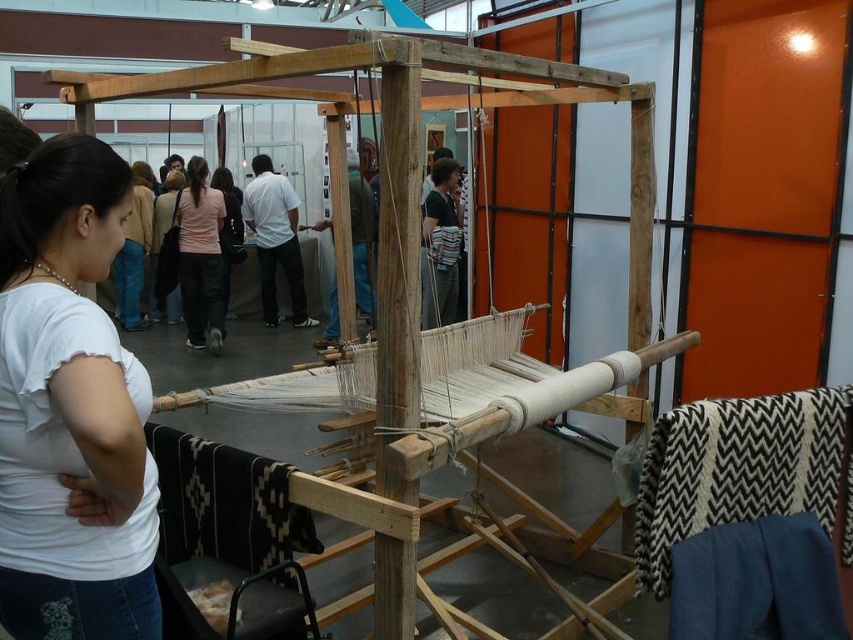
Question: Estimate the real-world distances between objects in this image. Which object is closer to the white cotton shirt at left?

Choices:
 (A) black and white zigzag fabric at lower right
 (B) pink fabric at center

Answer: (A)

Question: Does black and white zigzag fabric at lower right have a smaller size compared to pink fabric at center?

Choices:
 (A) yes
 (B) no

Answer: (A)

Question: Which object is farther from the camera taking this photo?

Choices:
 (A) black and white zigzag fabric at lower right
 (B) white cotton shirt at left
 (C) pink fabric at center

Answer: (C)

Question: Which point is closer to the camera?

Choices:
 (A) pink fabric at center
 (B) black and white zigzag fabric at lower right
 (C) white cotton shirt at left

Answer: (C)

Question: Is black and white zigzag fabric at lower right thinner than pink fabric at center?

Choices:
 (A) no
 (B) yes

Answer: (A)

Question: Does white cotton shirt at left appear over pink fabric at center?

Choices:
 (A) no
 (B) yes

Answer: (A)